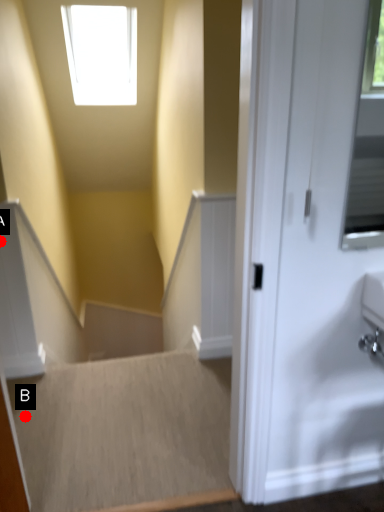
Question: Two points are circled on the image, labeled by A and B beside each circle. Which point is farther from the camera taking this photo?

Choices:
 (A) A is further
 (B) B is further

Answer: (A)